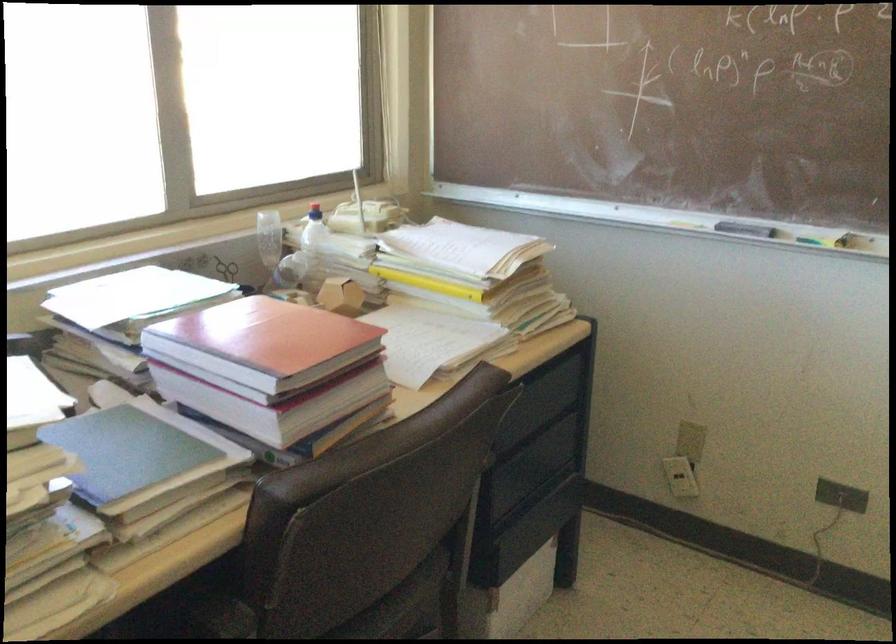
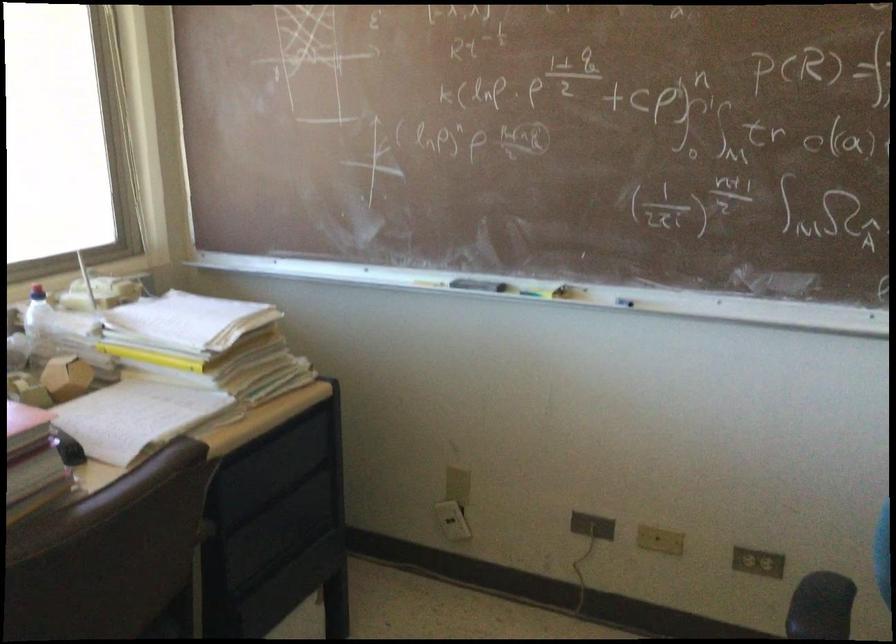
Locate, in the second image, the point that corresponds to (x=683, y=468) in the first image.

(452, 520)